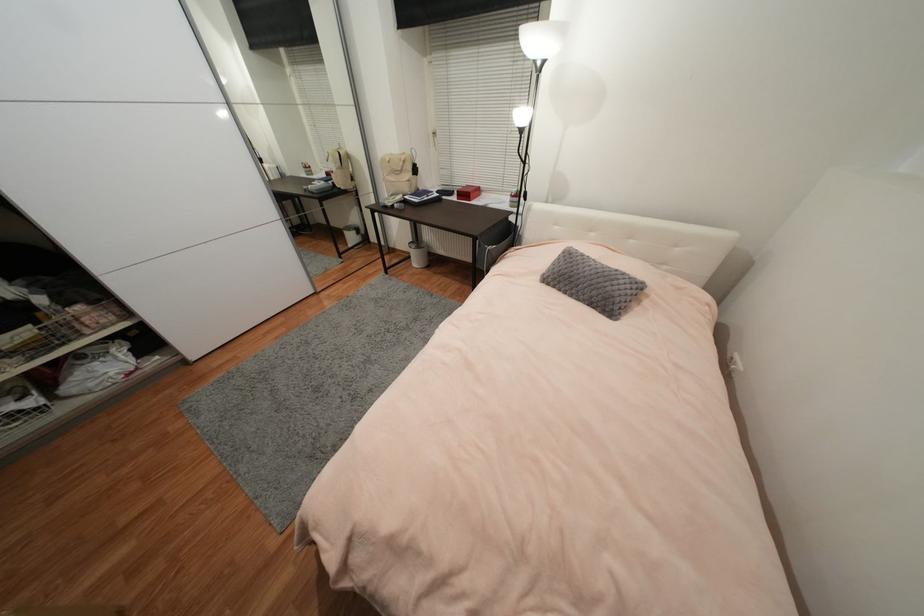
At what (x,y) coordinates should I click in order to perform the action: click on wire drawer basket. Please return your answer as a coordinate pair (x, y). Looking at the image, I should click on (19, 405).